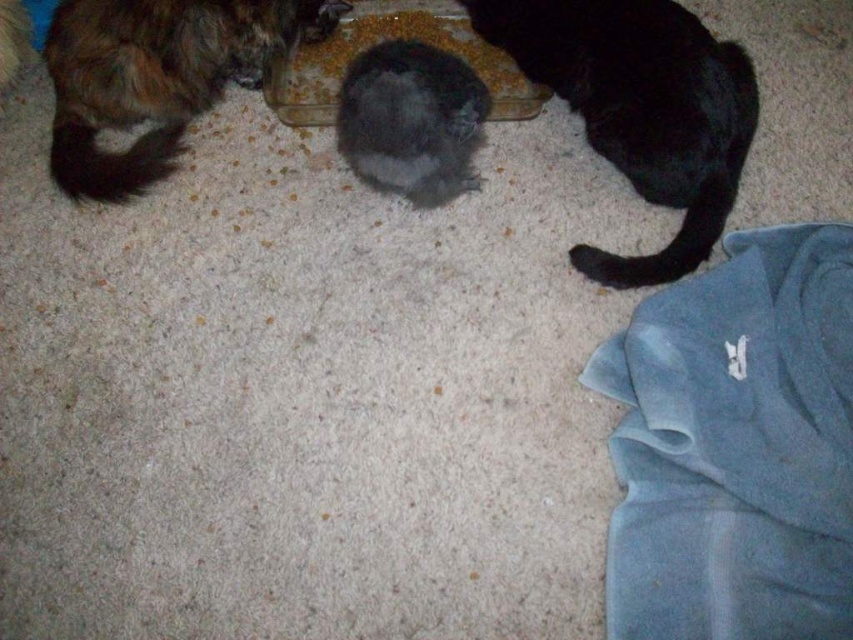
Question: Does shaggy brown fur cat at upper left have a greater width compared to smooth plastic bowl at center?

Choices:
 (A) yes
 (B) no

Answer: (A)

Question: Considering the relative positions of fluffy black cat at center and smooth plastic bowl at center in the image provided, where is fluffy black cat at center located with respect to smooth plastic bowl at center?

Choices:
 (A) below
 (B) above

Answer: (A)

Question: Which of the following is the farthest from the observer?

Choices:
 (A) (494, 112)
 (B) (376, 134)
 (C) (515, 45)

Answer: (C)

Question: Can you confirm if shaggy brown fur cat at upper left is positioned to the right of fluffy black cat at center?

Choices:
 (A) yes
 (B) no

Answer: (B)

Question: Which of the following is the closest to the observer?

Choices:
 (A) (540, 13)
 (B) (125, 28)
 (C) (345, 54)
 (D) (352, 104)

Answer: (B)

Question: Among these points, which one is nearest to the camera?

Choices:
 (A) (625, 38)
 (B) (445, 51)
 (C) (119, 120)

Answer: (A)